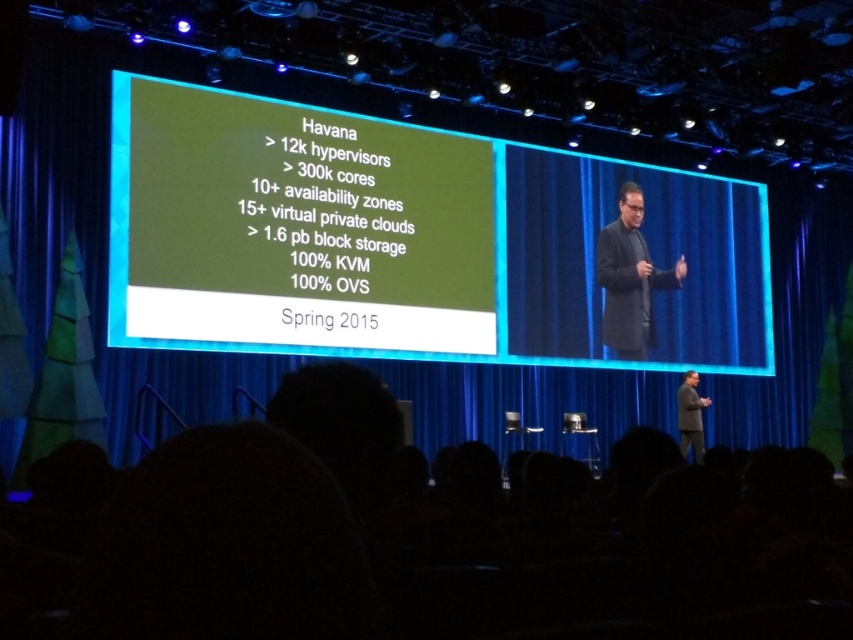
Consider the image. Is green matte text at upper center bigger than dark gray suit at center?

Indeed, green matte text at upper center has a larger size compared to dark gray suit at center.

Which is behind, point (397, 276) or point (693, 394)?

Point (693, 394)

The image size is (853, 640). What are the coordinates of `green matte text at upper center` in the screenshot? It's located at (296, 225).

Is green matte text at upper center to the left of dark gray coat at center from the viewer's perspective?

Indeed, green matte text at upper center is positioned on the left side of dark gray coat at center.

Does point (120, 172) lie behind point (645, 324)?

That is False.

Where is `green matte text at upper center`? The width and height of the screenshot is (853, 640). green matte text at upper center is located at coordinates (296, 225).

Between point (624, 320) and point (682, 410), which one is positioned in front?

Positioned in front is point (624, 320).

Between point (628, 280) and point (689, 436), which one is positioned in front?

Point (628, 280)

Find the location of a particular element. The width and height of the screenshot is (853, 640). dark gray coat at center is located at coordinates (630, 278).